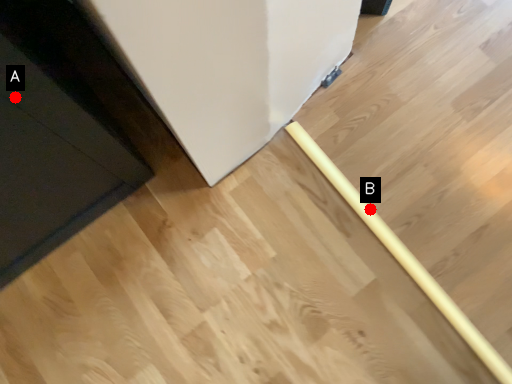
Question: Two points are circled on the image, labeled by A and B beside each circle. Which of the following is the closest to the observer?

Choices:
 (A) A is closer
 (B) B is closer

Answer: (A)